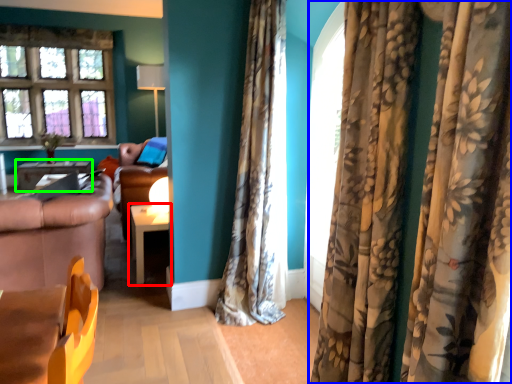
Question: Considering the real-world distances, which object is closest to table (highlighted by a red box)? curtain (highlighted by a blue box) or table (highlighted by a green box).

Choices:
 (A) curtain
 (B) table

Answer: (A)